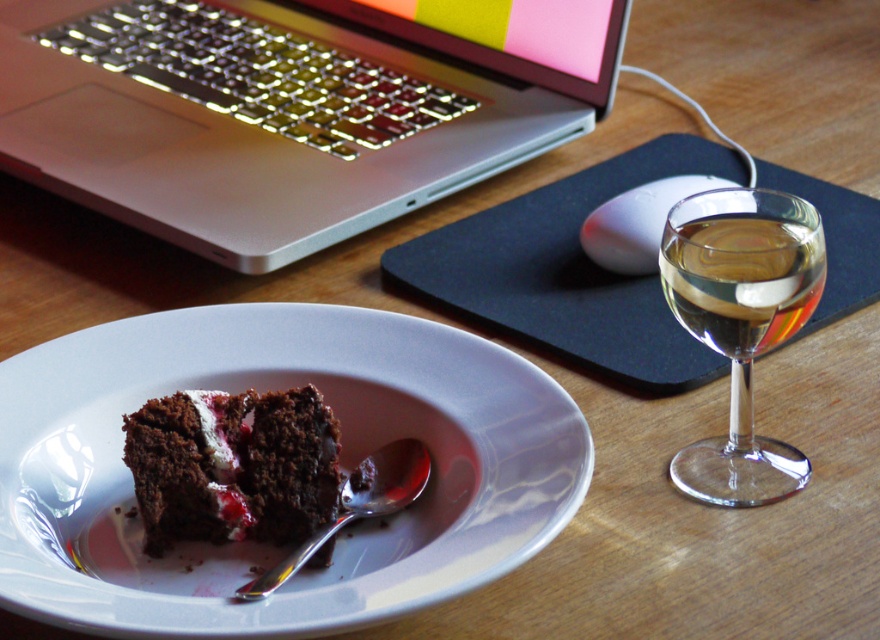
Does silver metallic laptop at upper left come in front of silver metallic spoon at plate center?

No.

Which is in front, point (206, 125) or point (396, 483)?

Point (396, 483) is in front.

Does point (180, 188) come farther from viewer compared to point (394, 458)?

Yes, point (180, 188) is behind point (394, 458).

Where is `silver metallic laptop at upper left`? This screenshot has height=640, width=880. silver metallic laptop at upper left is located at coordinates (291, 108).

Does transparent glass wine glass at right come in front of clear glass wine at right?

Yes, it is.

Is point (727, 326) positioned in front of point (739, 264)?

No, it is not.

The image size is (880, 640). I want to click on transparent glass wine glass at right, so click(x=741, y=323).

From the picture: Does silver metallic laptop at upper left have a lesser height compared to white glossy plate at center?

No, silver metallic laptop at upper left is not shorter than white glossy plate at center.

Which of these two, silver metallic laptop at upper left or white glossy plate at center, stands shorter?

Standing shorter between the two is white glossy plate at center.

Locate an element on the screen. silver metallic laptop at upper left is located at coordinates (291, 108).